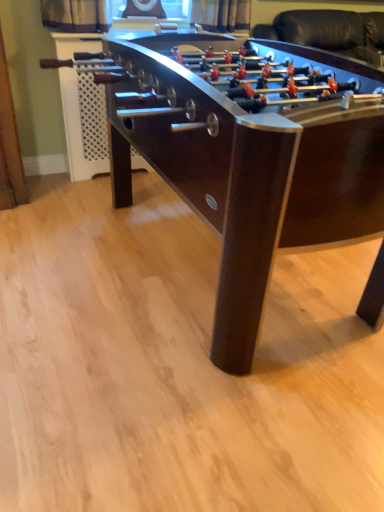
Question: Should I look upward or downward to see dark wood foosball table at center?

Choices:
 (A) down
 (B) up

Answer: (B)